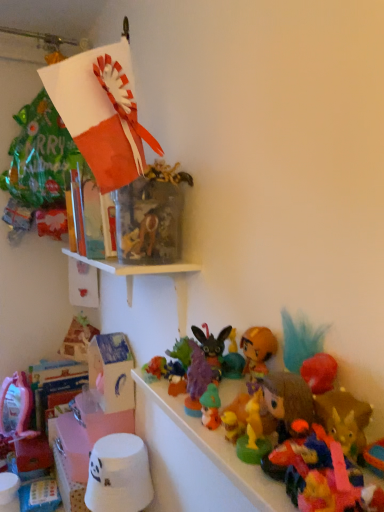
Describe the element at coordinates (25, 430) in the screenshot. I see `pink fabric doll at lower left, the eleventh toy in the front-to-back sequence` at that location.

Describe the element at coordinates (181, 351) in the screenshot. I see `purple felt plush at center, the 5th toy from the left` at that location.

Measure the distance between point (272, 349) and camera.

They are 69.20 centimeters apart.

Identify the location of white matte bucket at lower left, which is the 2th toy from back to front. (119, 475).

What are the coordinates of `translucent plastic toy at center, arranged as the 9th toy when viewed from the right` in the screenshot? It's located at (155, 369).

Looking at their sizes, would you say velvet purple plush rabbit at center, the eighth toy in the left-to-right sequence, is wider or thinner than white matte bucket at lower left, arranged as the tenth toy when viewed from the front?

Considering their sizes, velvet purple plush rabbit at center, the eighth toy in the left-to-right sequence, looks slimmer than white matte bucket at lower left, arranged as the tenth toy when viewed from the front.

From the image's perspective, who appears lower, velvet purple plush rabbit at center, which is the 5th toy from back to front, or white matte bucket at lower left, arranged as the tenth toy when viewed from the front?

From the image's view, white matte bucket at lower left, arranged as the tenth toy when viewed from the front, is below.

Is velvet purple plush rabbit at center, the eighth toy in the left-to-right sequence, positioned with its back to white matte bucket at lower left, the second toy in the left-to-right sequence?

velvet purple plush rabbit at center, the eighth toy in the left-to-right sequence, does not have its back to white matte bucket at lower left, the second toy in the left-to-right sequence.

Would you say velvet purple plush rabbit at center, positioned as the 4th toy in right-to-left order, is outside white matte bucket at lower left, which is the 2th toy from back to front?

Yes, velvet purple plush rabbit at center, positioned as the 4th toy in right-to-left order, is not within white matte bucket at lower left, which is the 2th toy from back to front.

Is purple felt plush at center, positioned as the third toy in back-to-front order, far away from purple felt bunny at center, the 6th toy in the left-to-right sequence?

purple felt plush at center, positioned as the third toy in back-to-front order, is near purple felt bunny at center, the 6th toy in the left-to-right sequence, not far away.

From the image's perspective, which one is positioned higher, purple felt plush at center, placed as the seventh toy when sorted from right to left, or purple felt bunny at center, the 6th toy in the left-to-right sequence?

purple felt plush at center, placed as the seventh toy when sorted from right to left, is shown above in the image.

Does point (191, 351) come behind point (195, 344)?

No, it is not.

From a real-world perspective, is purple felt plush at center, placed as the seventh toy when sorted from right to left, positioned under purple felt bunny at center, acting as the 6th toy starting from the right, based on gravity?

Correct, in the physical world, purple felt plush at center, placed as the seventh toy when sorted from right to left, is lower than purple felt bunny at center, acting as the 6th toy starting from the right.

Is purple felt bunny at center, the 6th toy in the left-to-right sequence, bigger or smaller than blue cardboard box at lower left?

Considering their sizes, purple felt bunny at center, the 6th toy in the left-to-right sequence, takes up less space than blue cardboard box at lower left.

Which is behind, point (194, 350) or point (90, 341)?

The point (90, 341) is farther.

Looking at this image, is purple felt bunny at center, the 6th toy in the left-to-right sequence, spatially inside blue cardboard box at lower left, or outside of it?

The correct answer is: outside.

In terms of width, does purple felt bunny at center, marked as the fourth toy in a front-to-back arrangement, look wider or thinner when compared to blue cardboard box at lower left?

In the image, purple felt bunny at center, marked as the fourth toy in a front-to-back arrangement, appears to be more narrow than blue cardboard box at lower left.

Does translucent plastic toy at center, which is the 4th toy in left-to-right order, have a lesser width compared to white matte bucket at lower left, arranged as the tenth toy when viewed from the front?

Correct, the width of translucent plastic toy at center, which is the 4th toy in left-to-right order, is less than that of white matte bucket at lower left, arranged as the tenth toy when viewed from the front.

Does point (174, 369) come behind point (101, 509)?

No.

Is translucent plastic toy at center, which is the 4th toy in left-to-right order, at the left side of white matte bucket at lower left, arranged as the tenth toy when viewed from the front?

In fact, translucent plastic toy at center, which is the 4th toy in left-to-right order, is to the right of white matte bucket at lower left, arranged as the tenth toy when viewed from the front.

From the image's perspective, which is below, translucent plastic toy at center, which is counted as the seventh toy, starting from the back, or white matte bucket at lower left, which is the 10th toy from right to left?

From the image's view, white matte bucket at lower left, which is the 10th toy from right to left, is below.

Considering the positions of point (99, 366) and point (169, 355), is point (99, 366) closer or farther from the camera than point (169, 355)?

Point (99, 366) is positioned farther from the camera compared to point (169, 355).

Is blue cardboard box at lower left looking in the opposite direction of purple felt plush at center, the 5th toy from the left?

No.

Relative to purple felt plush at center, the 5th toy from the left, is blue cardboard box at lower left in front or behind?

In the image, blue cardboard box at lower left appears behind purple felt plush at center, the 5th toy from the left.

The height and width of the screenshot is (512, 384). Find the location of `box to the left of purple felt plush at center, positioned as the third toy in back-to-front order`. box to the left of purple felt plush at center, positioned as the third toy in back-to-front order is located at coordinates (111, 371).

Which object is closer to the camera taking this photo, plush multicolored toy at lower right, placed as the first toy when sorted from front to back, or purple felt bunny at center, the 8th toy positioned from the back?

plush multicolored toy at lower right, placed as the first toy when sorted from front to back.

Is plush multicolored toy at lower right, arranged as the eleventh toy when viewed from the back, completely or partially outside of purple felt bunny at center, marked as the fourth toy in a front-to-back arrangement?

Indeed, plush multicolored toy at lower right, arranged as the eleventh toy when viewed from the back, is completely outside purple felt bunny at center, marked as the fourth toy in a front-to-back arrangement.

Which point is more forward, [337,442] or [187,380]?

The point [337,442] is in front.

Is plush multicolored toy at lower right, arranged as the eleventh toy when viewed from the back, wider than purple felt bunny at center, the 8th toy positioned from the back?

Yes, plush multicolored toy at lower right, arranged as the eleventh toy when viewed from the back, is wider than purple felt bunny at center, the 8th toy positioned from the back.

Can you confirm if purple felt bunny at center, acting as the 6th toy starting from the right, is bigger than plush multicolored toy at lower right, placed as the first toy when sorted from front to back?

No.

Is purple felt bunny at center, marked as the fourth toy in a front-to-back arrangement, turned away from plush multicolored toy at lower right, the 11th toy in the left-to-right sequence?

No, purple felt bunny at center, marked as the fourth toy in a front-to-back arrangement,'s orientation is not away from plush multicolored toy at lower right, the 11th toy in the left-to-right sequence.

Measure the distance between purple felt bunny at center, the 8th toy positioned from the back, and plush multicolored toy at lower right, placed as the first toy when sorted from front to back.

purple felt bunny at center, the 8th toy positioned from the back, and plush multicolored toy at lower right, placed as the first toy when sorted from front to back, are 19.78 centimeters apart.

Which is in front, point (204, 387) or point (271, 453)?

The point (271, 453) is more forward.

The width and height of the screenshot is (384, 512). What are the coordinates of `toy that is the 6th one when counting rightward from the white matte bucket at lower left, which is the 2th toy from back to front` in the screenshot? It's located at (212, 347).

From a real-world perspective, count 2nd toys downward from the purple felt bunny at center, acting as the 6th toy starting from the right, and point to it. Please provide its 2D coordinates.

[(181, 351)]

From the image, which object appears to be farther from translucent plastic toy at center, arranged as the 9th toy when viewed from the right, purple felt bunny at center, the 6th toy in the left-to-right sequence, or pink fabric doll at lower left, the first toy positioned from the back?

Based on the image, pink fabric doll at lower left, the first toy positioned from the back, appears to be further to translucent plastic toy at center, arranged as the 9th toy when viewed from the right.

In the scene shown: Estimate the real-world distances between objects in this image. Which object is further from velvet purple plush rabbit at center, positioned as the 4th toy in right-to-left order, translucent plastic toy at center, which appears as the eighth toy when viewed from the right, or blue cardboard box at lower left?

blue cardboard box at lower left.

Considering their positions, is blue cardboard box at lower left positioned further to orange matte figurine at center-right, the 6th toy from the back, than purple felt plush at center, positioned as the third toy in back-to-front order?

The object further to orange matte figurine at center-right, the 6th toy from the back, is blue cardboard box at lower left.

When comparing their distances from translucent plastic toy at center, the fifth toy when ordered from front to back, does plush brown bear at center, arranged as the 10th toy when viewed from the back, or plush multicolored toy at lower right, the 11th toy in the left-to-right sequence, seem further?

plush brown bear at center, arranged as the 10th toy when viewed from the back, lies further to translucent plastic toy at center, the fifth toy when ordered from front to back, than the other object.

From the image, which object appears to be farther from white matte bucket at lower left, which is the 2th toy from back to front, purple felt bunny at center, the 8th toy positioned from the back, or velvet purple plush rabbit at center, positioned as the 4th toy in right-to-left order?

Based on the image, purple felt bunny at center, the 8th toy positioned from the back, appears to be further to white matte bucket at lower left, which is the 2th toy from back to front.

Looking at the image, which one is located closer to plush multicolored toy at lower right, placed as the first toy when sorted from front to back, white matte bucket at lower left, the second toy in the left-to-right sequence, or orange matte figurine at center-right, the 6th toy viewed from the front?

orange matte figurine at center-right, the 6th toy viewed from the front.

Estimate the real-world distances between objects in this image. Which object is closer to purple felt bunny at center, the 8th toy positioned from the back, white matte bucket at lower left, which is the 2th toy from back to front, or translucent plastic toy at center, which is the third toy from left to right?

translucent plastic toy at center, which is the third toy from left to right, lies closer to purple felt bunny at center, the 8th toy positioned from the back, than the other object.

Looking at the image, which one is located closer to plush multicolored toy at lower right, the 1th toy positioned from the right, velvet purple plush rabbit at center, which appears as the seventh toy when viewed from the front, or translucent plastic toy at center, which is the third toy from left to right?

Among the two, velvet purple plush rabbit at center, which appears as the seventh toy when viewed from the front, is located nearer to plush multicolored toy at lower right, the 1th toy positioned from the right.

Identify the location of box located between velvet purple plush rabbit at center, which is the 5th toy from back to front, and pink fabric doll at lower left, the eleventh toy in the front-to-back sequence, in the depth direction. The width and height of the screenshot is (384, 512). (111, 371).

Identify the location of toy positioned between plush multicolored toy at lower right, the 11th toy in the left-to-right sequence, and plush green rabbit at center, which appears as the ninth toy when viewed from the back, from near to far. The width and height of the screenshot is (384, 512). 197,460.

Where is `toy between plush green rabbit at center, arranged as the seventh toy when viewed from the left, and translucent plastic toy at center, which appears as the eighth toy when viewed from the right, along the z-axis`? toy between plush green rabbit at center, arranged as the seventh toy when viewed from the left, and translucent plastic toy at center, which appears as the eighth toy when viewed from the right, along the z-axis is located at coordinates (197, 379).

I want to click on toy between purple felt plush at center, positioned as the third toy in back-to-front order, and blue cardboard box at lower left from front to back, so click(x=119, y=475).